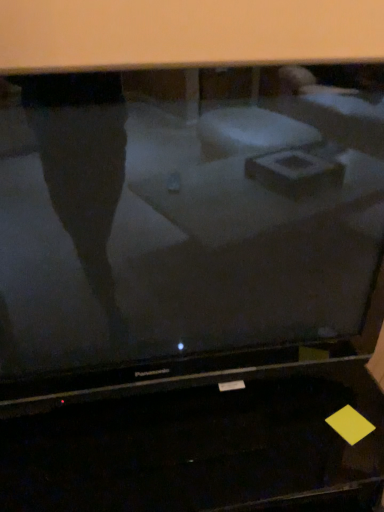
Question: Does matte black television at center come in front of black glossy desktop at lower center?

Choices:
 (A) no
 (B) yes

Answer: (B)

Question: Does matte black television at center have a larger size compared to black glossy desktop at lower center?

Choices:
 (A) no
 (B) yes

Answer: (A)

Question: Can you confirm if matte black television at center is taller than black glossy desktop at lower center?

Choices:
 (A) no
 (B) yes

Answer: (B)

Question: Considering the relative positions of matte black television at center and black glossy desktop at lower center in the image provided, is matte black television at center to the left of black glossy desktop at lower center from the viewer's perspective?

Choices:
 (A) yes
 (B) no

Answer: (B)

Question: Is matte black television at center at the right side of black glossy desktop at lower center?

Choices:
 (A) no
 (B) yes

Answer: (B)

Question: From a real-world perspective, is matte black television at center beneath black glossy desktop at lower center?

Choices:
 (A) yes
 (B) no

Answer: (B)

Question: Can you confirm if black glossy desktop at lower center is shorter than matte black television at center?

Choices:
 (A) no
 (B) yes

Answer: (B)

Question: Is the position of black glossy desktop at lower center less distant than that of matte black television at center?

Choices:
 (A) no
 (B) yes

Answer: (A)

Question: Is black glossy desktop at lower center beside matte black television at center?

Choices:
 (A) no
 (B) yes

Answer: (A)

Question: Considering the relative positions of black glossy desktop at lower center and matte black television at center in the image provided, is black glossy desktop at lower center to the left of matte black television at center from the viewer's perspective?

Choices:
 (A) yes
 (B) no

Answer: (A)

Question: Is black glossy desktop at lower center located outside matte black television at center?

Choices:
 (A) no
 (B) yes

Answer: (B)

Question: Is black glossy desktop at lower center to the right of matte black television at center from the viewer's perspective?

Choices:
 (A) no
 (B) yes

Answer: (A)

Question: From the image's perspective, relative to matte black television at center, is black glossy desktop at lower center above or below?

Choices:
 (A) above
 (B) below

Answer: (B)